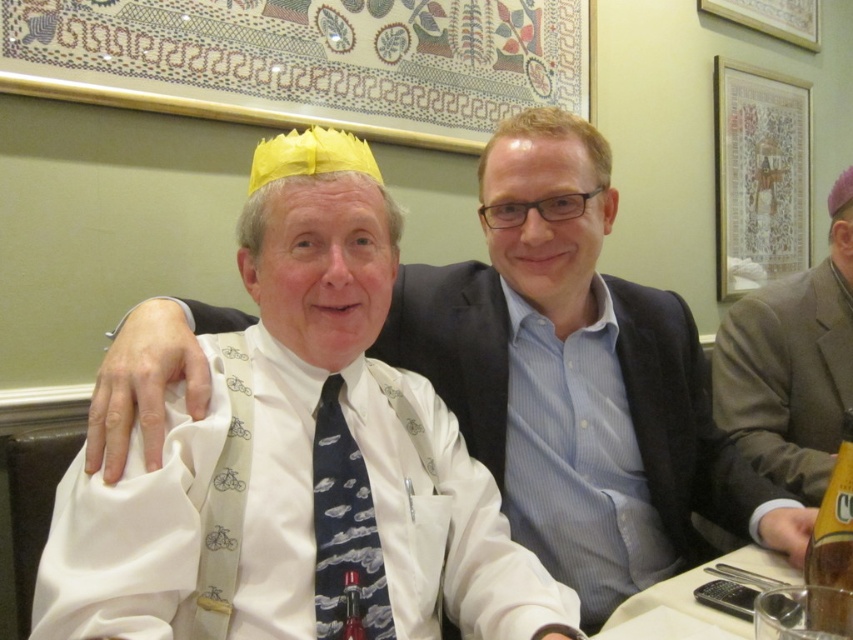
Question: Does pink fabric hat at upper right have a smaller size compared to bicycle-patterned silk tie at left?

Choices:
 (A) no
 (B) yes

Answer: (A)

Question: Which of these objects is positioned farthest from the amber glass bottle at lower right?

Choices:
 (A) bicycle-patterned silk tie at left
 (B) matte yellow paper crown at upper left
 (C) pink fabric hat at upper right
 (D) cloud-patterned silk tie at center

Answer: (C)

Question: Considering the relative positions of matte yellow paper crown at upper left and cloud-patterned silk tie at center in the image provided, where is matte yellow paper crown at upper left located with respect to cloud-patterned silk tie at center?

Choices:
 (A) left
 (B) right

Answer: (B)

Question: Which point is farther from the camera taking this photo?

Choices:
 (A) (718, 372)
 (B) (810, 628)
 (C) (235, 413)
 (D) (625, 317)

Answer: (A)

Question: Can you confirm if bicycle-patterned silk tie at left is smaller than amber glass bottle at lower right?

Choices:
 (A) yes
 (B) no

Answer: (B)

Question: Which object appears farthest from the camera in this image?

Choices:
 (A) matte yellow paper crown at upper left
 (B) amber glass bottle at lower right
 (C) bicycle-patterned silk tie at left
 (D) cloud-patterned silk tie at center

Answer: (D)